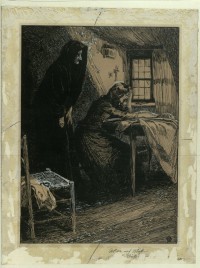
Identify the location of window. (142, 69).